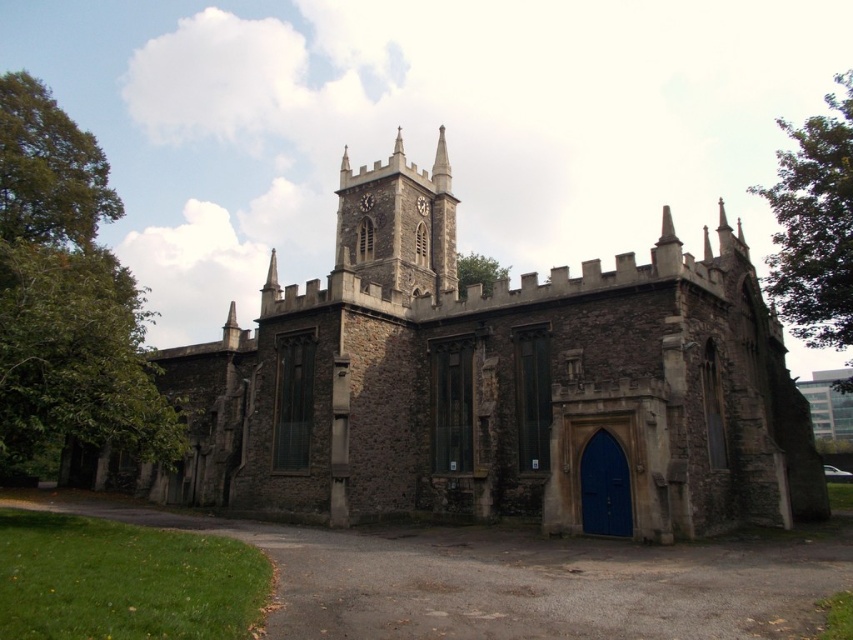
You are a tour guide explaining the architecture of the church to visitors. You mention the dark gray stone clock tower at center and the metallic clock at center. Which one is taller?

The dark gray stone clock tower at center is taller than the metallic clock at center.

You are an architect assessing the stone church at center and the blue matte door at center. Based on their sizes, which one would require more materials for a scale model?

The stone church at center has a greater height compared to the blue matte door at center, so it would require more materials for a scale model.